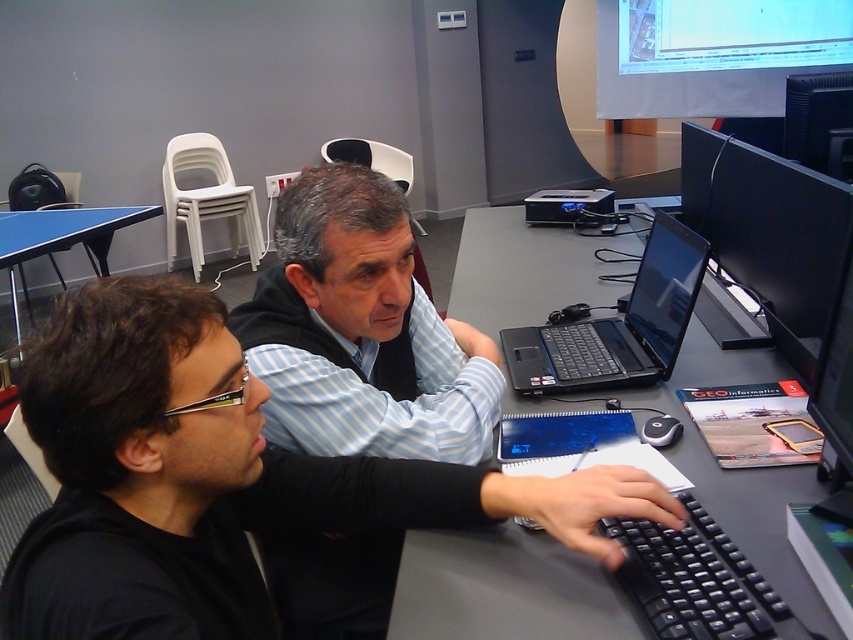
Does blue striped shirt at center have a lesser width compared to black plastic keyboard at lower right?

No, blue striped shirt at center is not thinner than black plastic keyboard at lower right.

This screenshot has width=853, height=640. What do you see at coordinates (361, 332) in the screenshot?
I see `blue striped shirt at center` at bounding box center [361, 332].

Find the location of a particular element. The height and width of the screenshot is (640, 853). blue striped shirt at center is located at coordinates (361, 332).

Consider the image. Between black matte shirt at center and blue striped shirt at center, which one has less height?

black matte shirt at center

Does black matte shirt at center appear on the right side of blue striped shirt at center?

Indeed, black matte shirt at center is positioned on the right side of blue striped shirt at center.

Is point (448, 465) positioned after point (283, 301)?

No, (448, 465) is in front of (283, 301).

You are a GUI agent. You are given a task and a screenshot of the screen. Output one action in this format:
    pyautogui.click(x=<x>, y=<y>)
    Task: Click on the black matte shirt at center
    
    Given the screenshot: What is the action you would take?
    pyautogui.click(x=219, y=477)

Between black plastic computer desk at center and blue striped shirt at center, which one is positioned lower?

blue striped shirt at center is below.

Can you confirm if black plastic computer desk at center is smaller than blue striped shirt at center?

No.

Where is `black plastic computer desk at center`? The height and width of the screenshot is (640, 853). black plastic computer desk at center is located at coordinates (503, 589).